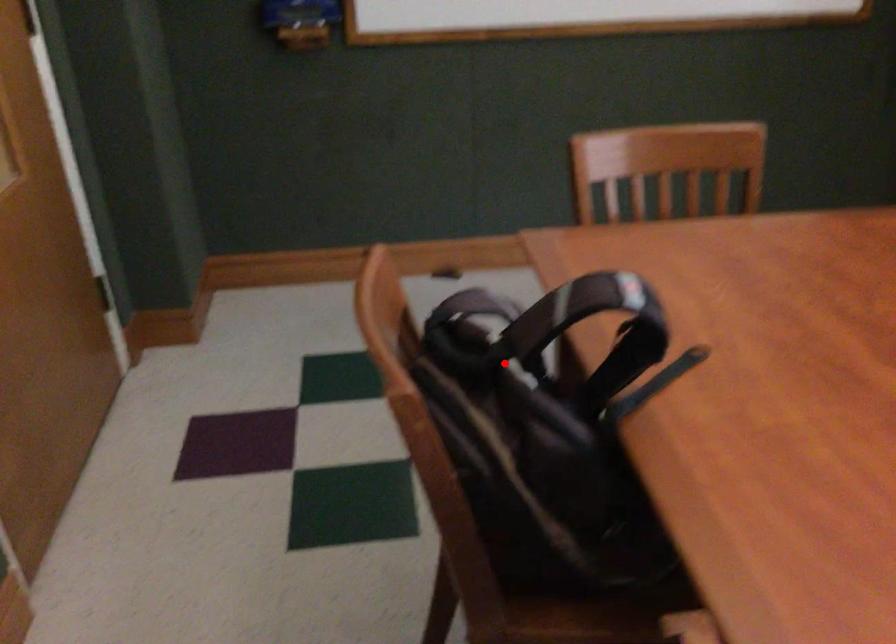
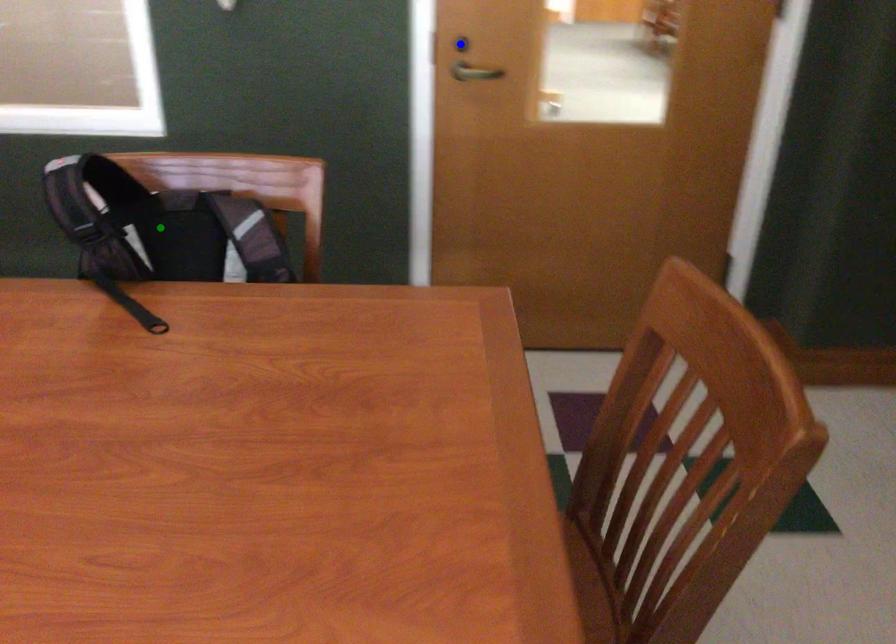
Question: I am providing you with two images of the same scene from different viewpoints. A red point is marked on the first image. You are given multiple points on the second image. Which point in image 2 is actually the same real-world point as the red point in image 1?

Choices:
 (A) blue point
 (B) yellow point
 (C) green point

Answer: (B)